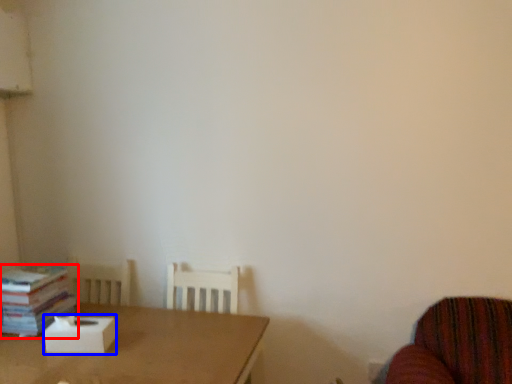
Question: Which point is further to the camera, book (highlighted by a red box) or cardboard box (highlighted by a blue box)?

Choices:
 (A) book
 (B) cardboard box

Answer: (A)